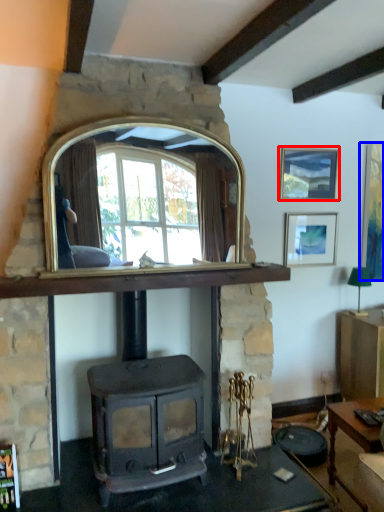
Question: Which object is closer to the camera taking this photo, picture frame (highlighted by a red box) or picture frame (highlighted by a blue box)?

Choices:
 (A) picture frame
 (B) picture frame

Answer: (A)